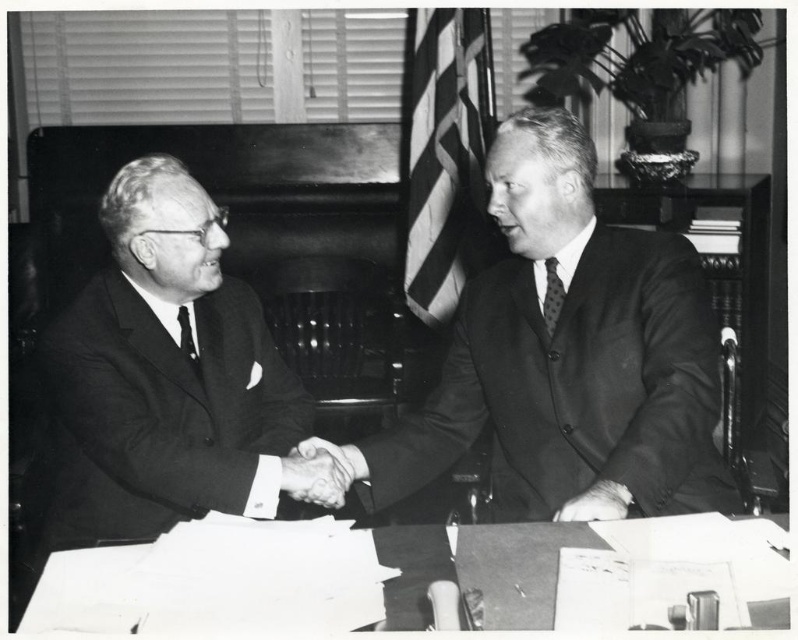
Question: Is the position of smooth black suit at left more distant than that of smooth skin handshake at center?

Choices:
 (A) no
 (B) yes

Answer: (A)

Question: Does smooth black suit at center appear on the left side of polka dot silk tie at right?

Choices:
 (A) no
 (B) yes

Answer: (B)

Question: Estimate the real-world distances between objects in this image. Which object is closer to the matte black tie at left?

Choices:
 (A) smooth skin handshake at center
 (B) smooth black suit at left
 (C) smooth skin hand at center
 (D) polka dot silk tie at right

Answer: (B)

Question: Which object appears closest to the camera in this image?

Choices:
 (A) white paper at lower center
 (B) smooth skin hand at center
 (C) matte black tie at left

Answer: (A)

Question: Is smooth black suit at center smaller than matte black tie at left?

Choices:
 (A) yes
 (B) no

Answer: (B)

Question: Which object is positioned closest to the matte black tie at left?

Choices:
 (A) smooth skin handshake at center
 (B) smooth skin hand at center
 (C) smooth black suit at left

Answer: (C)